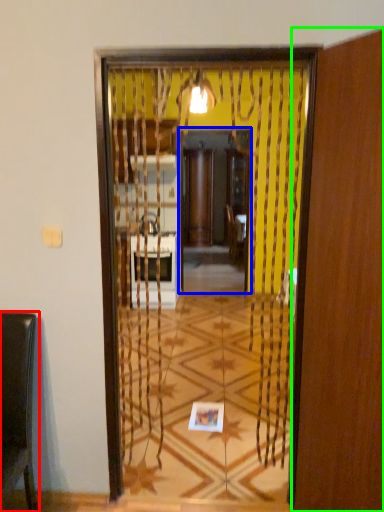
Question: Based on their relative distances, which object is nearer to furniture (highlighted by a red box)? Choose from screen door (highlighted by a blue box) and screen door (highlighted by a green box).

Choices:
 (A) screen door
 (B) screen door

Answer: (B)